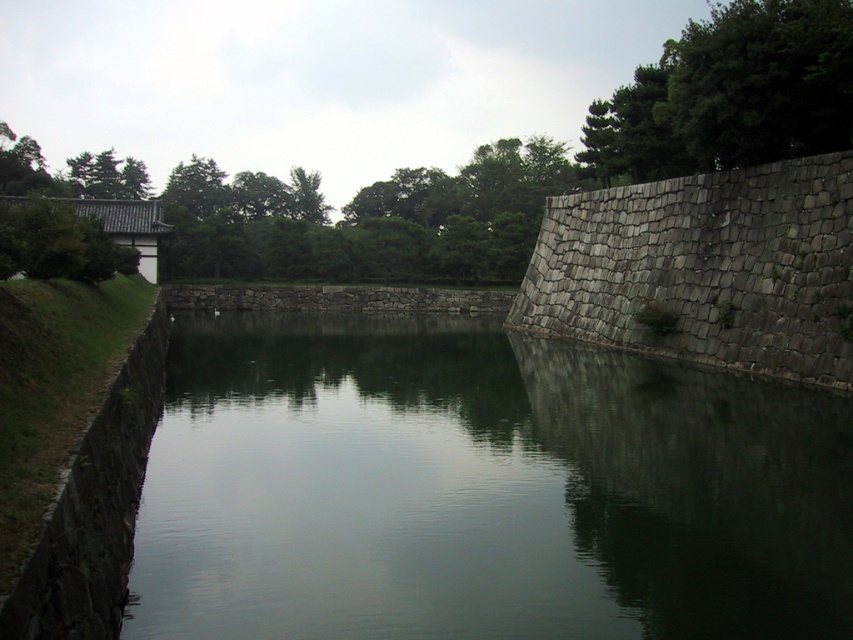
Question: Which point is farther to the camera?

Choices:
 (A) (102, 561)
 (B) (747, 412)

Answer: (B)

Question: Which object is closer to the camera taking this photo?

Choices:
 (A) green stone wall at center
 (B) dark gray stone moat at left

Answer: (B)

Question: Can you confirm if green stone wall at center is positioned to the left of dark gray stone moat at left?

Choices:
 (A) yes
 (B) no

Answer: (B)

Question: Does green stone wall at center appear on the right side of dark gray stone moat at left?

Choices:
 (A) no
 (B) yes

Answer: (B)

Question: Is green stone wall at center in front of dark gray stone moat at left?

Choices:
 (A) no
 (B) yes

Answer: (A)